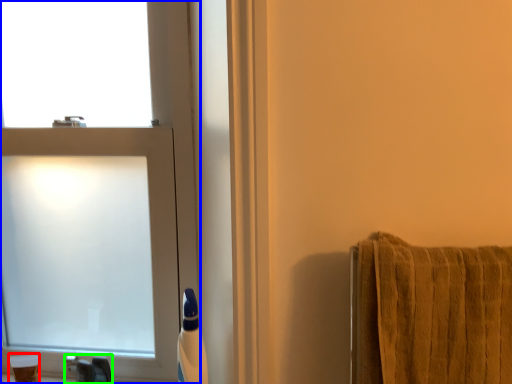
Question: Based on their relative distances, which object is nearer to toiletry (highlighted by a red box)? Choose from window (highlighted by a blue box) and faucet (highlighted by a green box).

Choices:
 (A) window
 (B) faucet

Answer: (B)